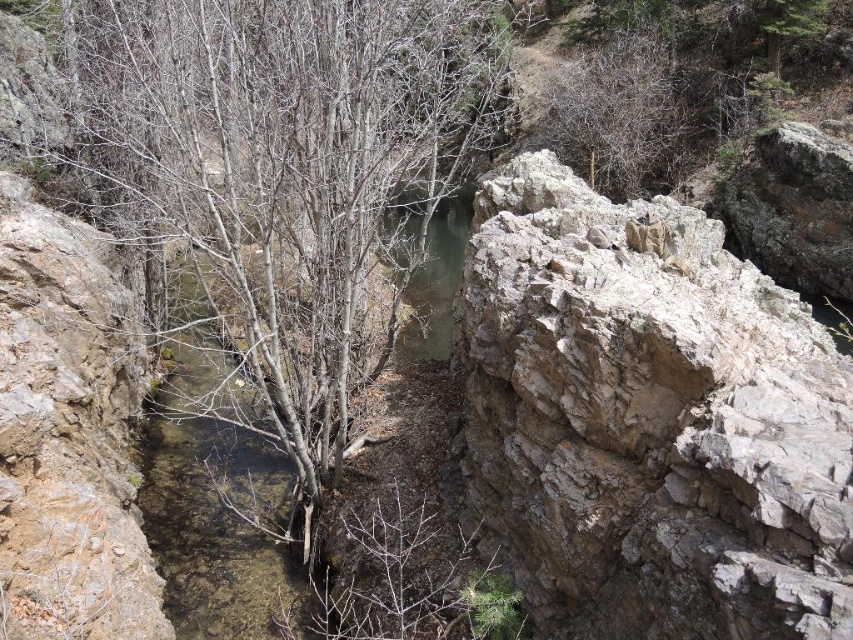
Question: Among these points, which one is farthest from the camera?

Choices:
 (A) (556, 332)
 (B) (305, 236)

Answer: (B)

Question: Which of the following is the farthest from the observer?

Choices:
 (A) clear water at center
 (B) gray rough rock at center right
 (C) smooth bark tree at center

Answer: (A)

Question: From the image, what is the correct spatial relationship of smooth bark tree at center in relation to clear water at center?

Choices:
 (A) below
 (B) above

Answer: (B)

Question: Can you confirm if gray rough rock at center right is positioned to the right of clear water at center?

Choices:
 (A) yes
 (B) no

Answer: (A)

Question: Which is nearer to the smooth bark tree at center?

Choices:
 (A) clear water at center
 (B) gray rough rock at center right

Answer: (A)

Question: Is gray rough rock at center right positioned behind smooth bark tree at center?

Choices:
 (A) yes
 (B) no

Answer: (B)